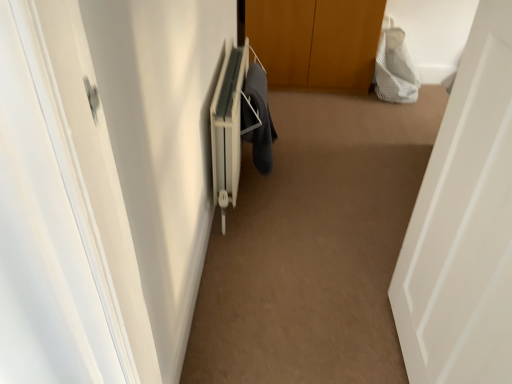
Question: Does white matte door at right have a greater width compared to white striped fabric at upper right?

Choices:
 (A) no
 (B) yes

Answer: (B)

Question: Are white matte door at right and white striped fabric at upper right located far from each other?

Choices:
 (A) no
 (B) yes

Answer: (B)

Question: Is white matte door at right behind white striped fabric at upper right?

Choices:
 (A) no
 (B) yes

Answer: (A)

Question: Considering the relative sizes of white matte door at right and white striped fabric at upper right in the image provided, is white matte door at right smaller than white striped fabric at upper right?

Choices:
 (A) no
 (B) yes

Answer: (B)

Question: Is white matte door at right not inside white striped fabric at upper right?

Choices:
 (A) no
 (B) yes

Answer: (B)

Question: Does white matte door at right have a lesser width compared to white striped fabric at upper right?

Choices:
 (A) yes
 (B) no

Answer: (B)

Question: From a real-world perspective, is dark gray fabric at center positioned over white striped fabric at upper right based on gravity?

Choices:
 (A) no
 (B) yes

Answer: (B)

Question: Are dark gray fabric at center and white striped fabric at upper right far apart?

Choices:
 (A) yes
 (B) no

Answer: (A)

Question: Is dark gray fabric at center to the left of white striped fabric at upper right from the viewer's perspective?

Choices:
 (A) no
 (B) yes

Answer: (B)

Question: Is dark gray fabric at center facing towards white striped fabric at upper right?

Choices:
 (A) no
 (B) yes

Answer: (A)

Question: From a real-world perspective, is dark gray fabric at center positioned under white striped fabric at upper right based on gravity?

Choices:
 (A) yes
 (B) no

Answer: (B)

Question: Is dark gray fabric at center oriented away from white striped fabric at upper right?

Choices:
 (A) no
 (B) yes

Answer: (A)

Question: Could dark gray fabric at center be considered to be inside white matte door at right?

Choices:
 (A) no
 (B) yes

Answer: (A)